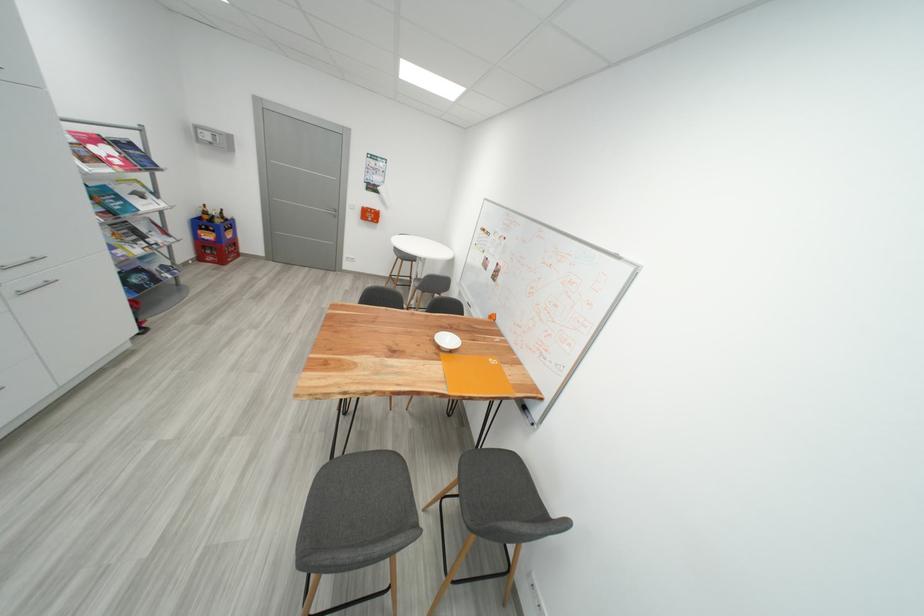
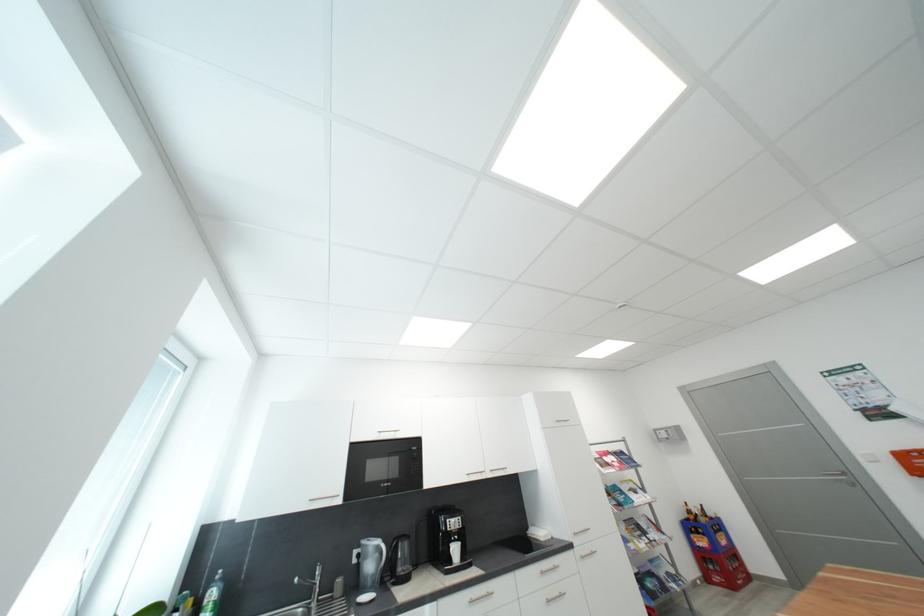
Where in the second image is the point corresponding to (x=225, y=223) from the first image?

(710, 522)